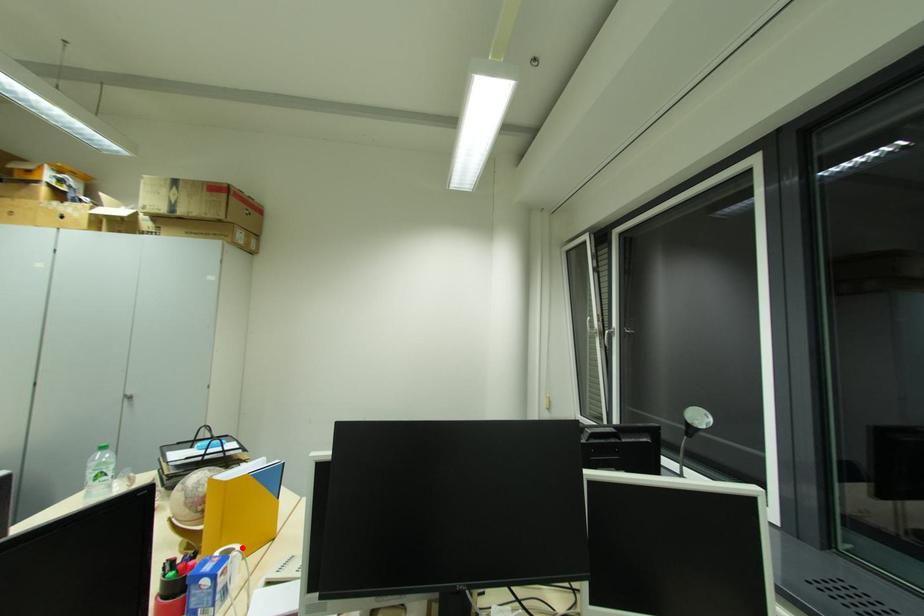
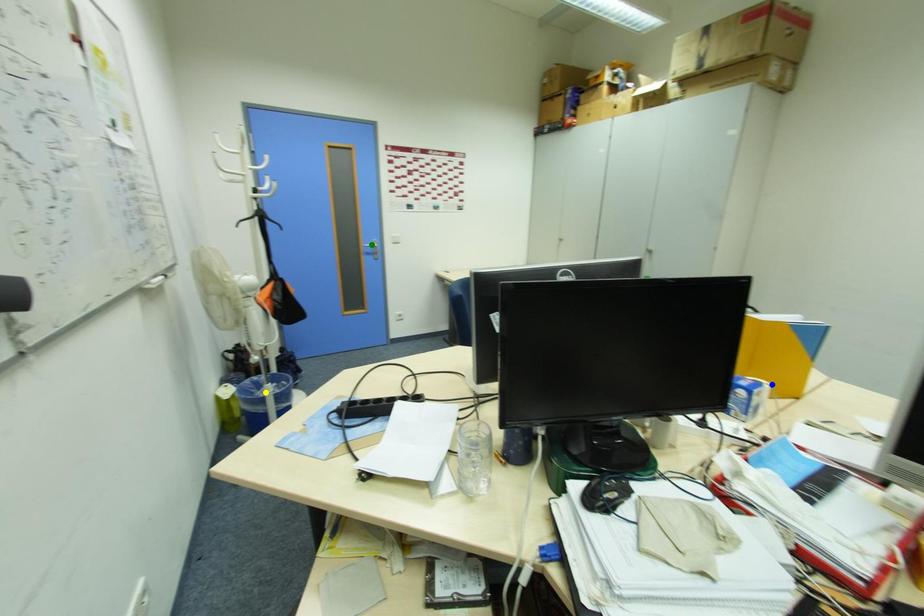
Question: I am providing you with two images of the same scene from different viewpoints. A red point is marked on the first image. You are given multiple points on the second image. In image 2, which mark is for the same physical point as the one in image 1?

Choices:
 (A) yellow point
 (B) green point
 (C) blue point

Answer: (C)